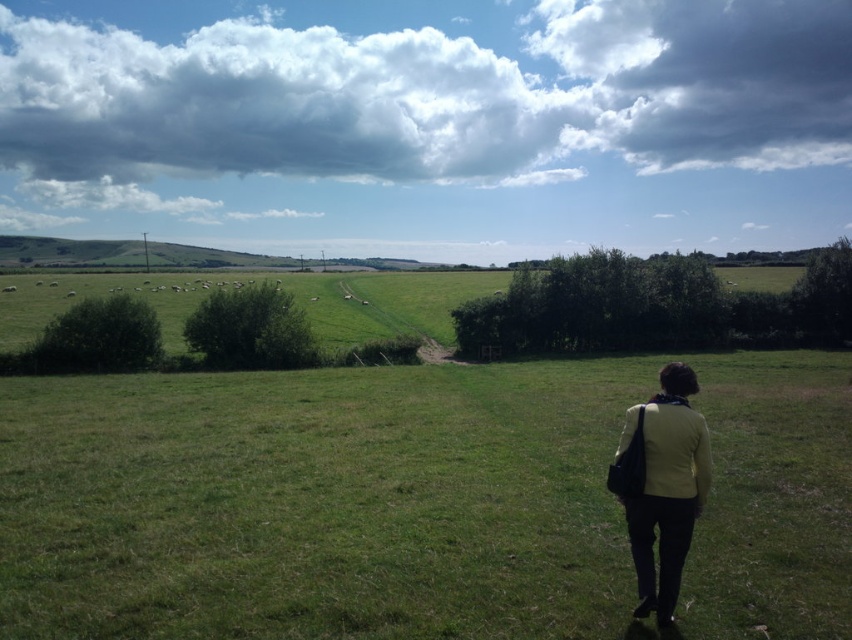
Question: Which object appears closest to the camera in this image?

Choices:
 (A) light yellow fabric jacket at lower right
 (B) green grassy field at center

Answer: (A)

Question: Can you confirm if green grassy field at center is positioned above cloudy sky at upper center?

Choices:
 (A) no
 (B) yes

Answer: (A)

Question: Which point is farther to the camera?

Choices:
 (A) light yellow fabric jacket at lower right
 (B) green grassy field at center
 (C) cloudy sky at upper center

Answer: (C)

Question: Based on their relative distances, which object is nearer to the green grassy field at center?

Choices:
 (A) cloudy sky at upper center
 (B) light yellow fabric jacket at lower right

Answer: (B)

Question: Where is green grassy field at center located in relation to cloudy sky at upper center in the image?

Choices:
 (A) left
 (B) right

Answer: (B)

Question: Is green grassy field at center wider than cloudy sky at upper center?

Choices:
 (A) yes
 (B) no

Answer: (B)